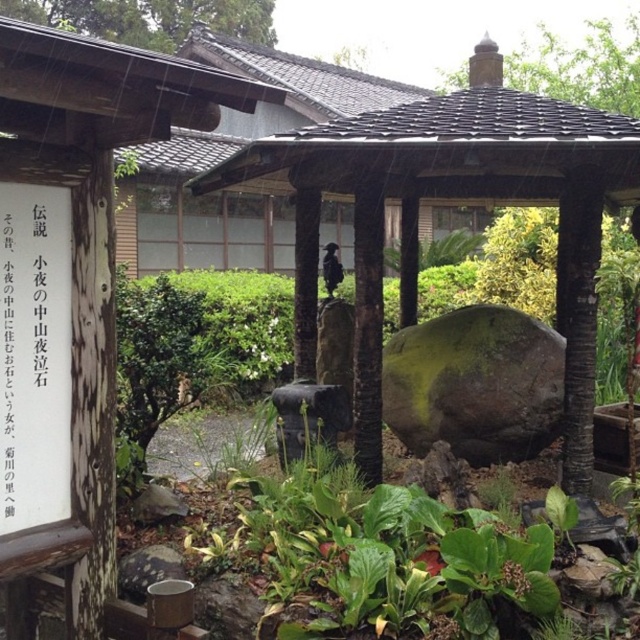
Is point (513, 163) positioned before point (26, 470)?

That is False.

What do you see at coordinates (452, 198) in the screenshot? I see `smooth wooden gazebo at center` at bounding box center [452, 198].

Between point (586, 310) and point (1, 326), which one is positioned in front?

Point (1, 326)

You are a GUI agent. You are given a task and a screenshot of the screen. Output one action in this format:
    pyautogui.click(x=<x>, y=<y>)
    Task: Click on the smooth wooden gazebo at center
    
    Given the screenshot: What is the action you would take?
    pyautogui.click(x=452, y=198)

Is smooth stone hut at center behind white paper sign at left?

No, smooth stone hut at center is in front of white paper sign at left.

Between smooth stone hut at center and white paper sign at left, which one has less height?

white paper sign at left

The image size is (640, 640). I want to click on smooth stone hut at center, so click(80, 280).

Which is below, smooth stone hut at center or smooth wooden gazebo at center?

Positioned lower is smooth stone hut at center.

How distant is smooth stone hut at center from smooth wooden gazebo at center?

smooth stone hut at center is 7.36 feet away from smooth wooden gazebo at center.

Is point (26, 248) closer to viewer compared to point (584, 369)?

Yes, it is in front of point (584, 369).

The image size is (640, 640). Identify the location of smooth stone hut at center. (80, 280).